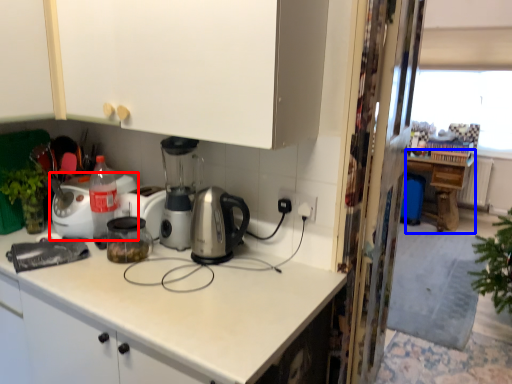
Question: Which object appears farthest to the camera in this image, home appliance (highlighted by a red box) or table (highlighted by a blue box)?

Choices:
 (A) home appliance
 (B) table

Answer: (B)